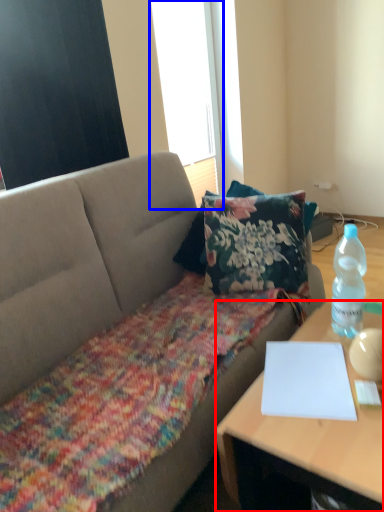
Question: Which of the following is the farthest to the observer, desk (highlighted by a red box) or window screen (highlighted by a blue box)?

Choices:
 (A) desk
 (B) window screen

Answer: (B)